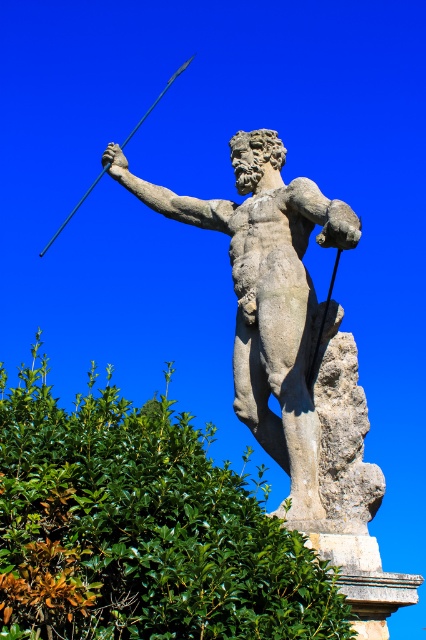
Is green leafy hedge at upper center closer to the viewer compared to smooth metal spear at upper left?

Yes, green leafy hedge at upper center is closer to the viewer.

Which is below, green leafy hedge at upper center or smooth metal spear at upper left?

green leafy hedge at upper center is lower down.

Measure the distance between point (x=189, y=586) and camera.

The distance of point (x=189, y=586) from camera is 41.44 meters.

Find the location of a particular element. The width and height of the screenshot is (426, 640). green leafy hedge at upper center is located at coordinates (141, 529).

Based on the photo, can you confirm if green leafy hedge at upper center is shorter than stone statue at center?

Indeed, green leafy hedge at upper center has a lesser height compared to stone statue at center.

Based on the photo, who is higher up, green leafy hedge at upper center or stone statue at center?

Positioned higher is stone statue at center.

This screenshot has height=640, width=426. What are the coordinates of `green leafy hedge at upper center` in the screenshot? It's located at (141, 529).

Can you confirm if stone statue at center is positioned to the right of smooth metal spear at upper left?

Correct, you'll find stone statue at center to the right of smooth metal spear at upper left.

Does point (262, 342) come farther from viewer compared to point (155, 104)?

No, (262, 342) is closer to viewer.

The image size is (426, 640). In order to click on stone statue at center in this screenshot , I will do `click(267, 292)`.